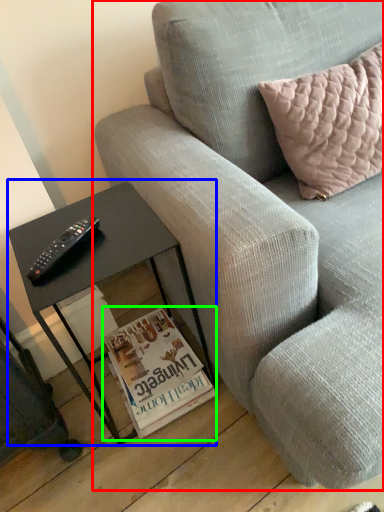
Question: Considering the real-world distances, which object is farthest from studio couch (highlighted by a red box)? table (highlighted by a blue box) or magazine (highlighted by a green box)?

Choices:
 (A) table
 (B) magazine

Answer: (B)